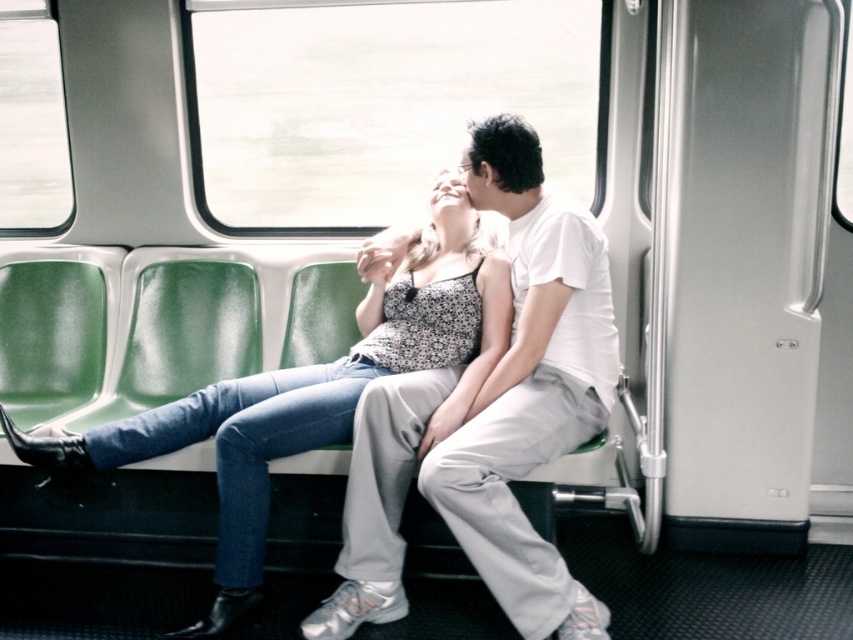
Does white cotton shirt at center have a lesser height compared to denim jeans at center?

No, white cotton shirt at center is not shorter than denim jeans at center.

Who is positioned more to the right, white cotton shirt at center or denim jeans at center?

white cotton shirt at center is more to the right.

Does point (602, 340) lie in front of point (422, 280)?

Yes, point (602, 340) is closer to viewer.

Identify the location of white cotton shirt at center. (490, 417).